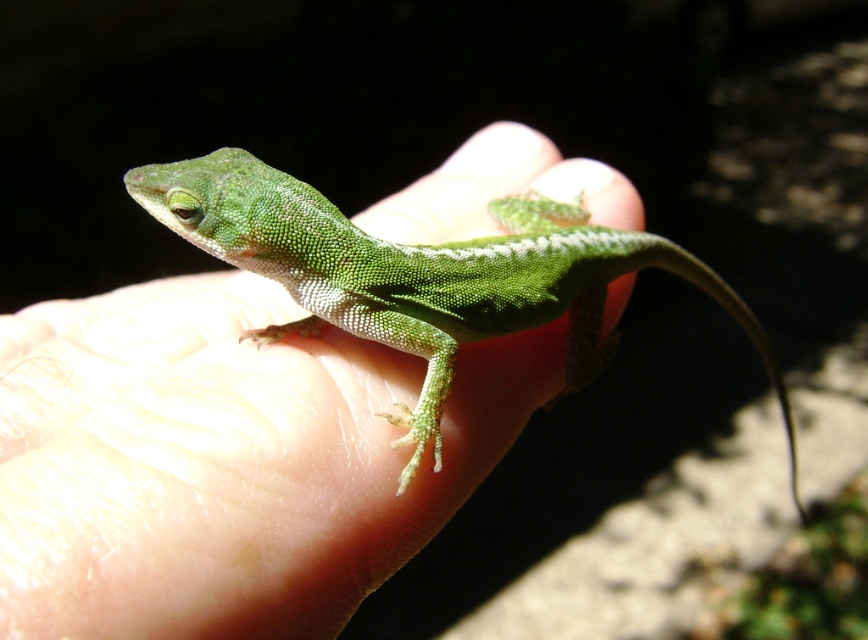
Is green matte lizard at center to the right of green matte tail at center from the viewer's perspective?

In fact, green matte lizard at center is to the left of green matte tail at center.

Does point (516, 220) lie in front of point (667, 262)?

That is True.

Locate an element on the screen. green matte lizard at center is located at coordinates (425, 275).